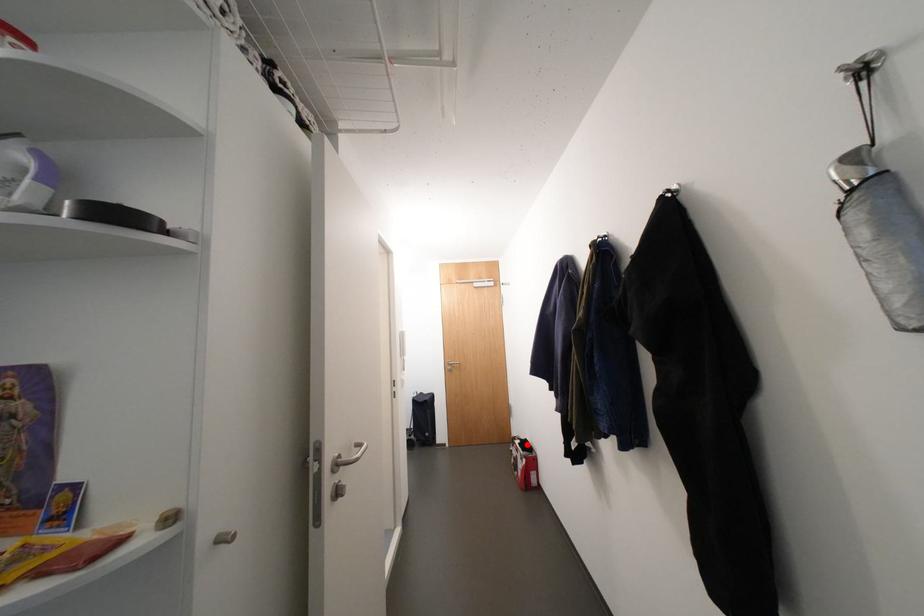
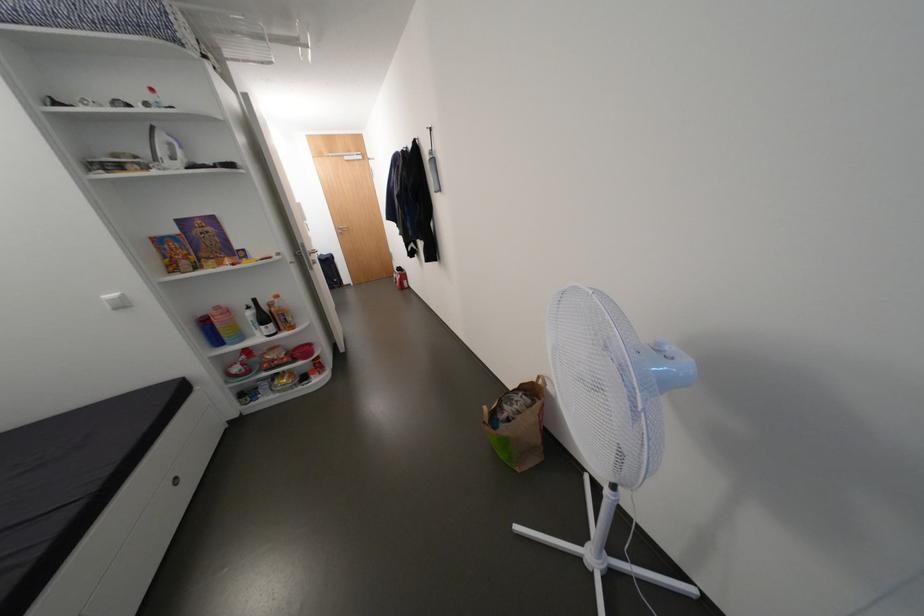
Find the pixel in the second image that matches the highlighted location in the first image.

(405, 270)